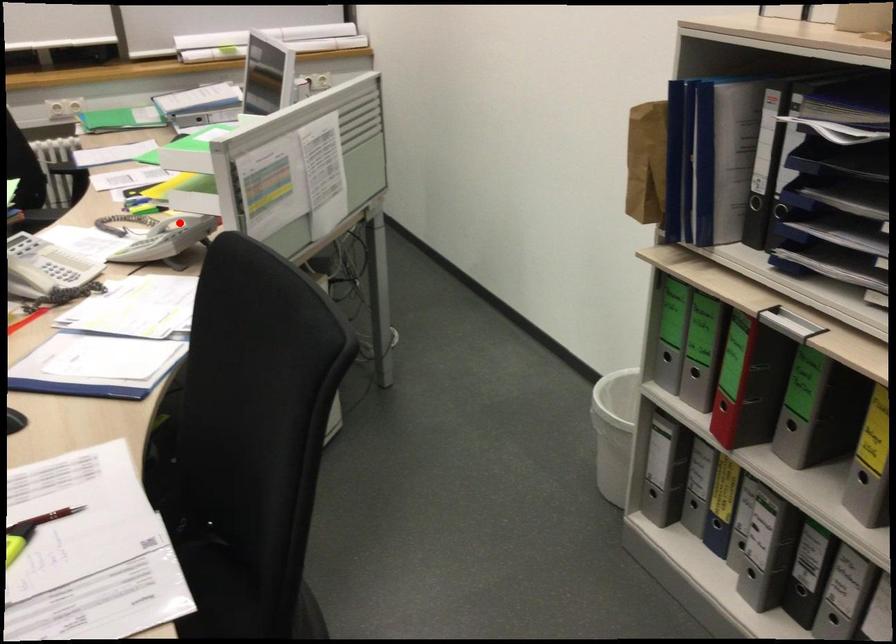
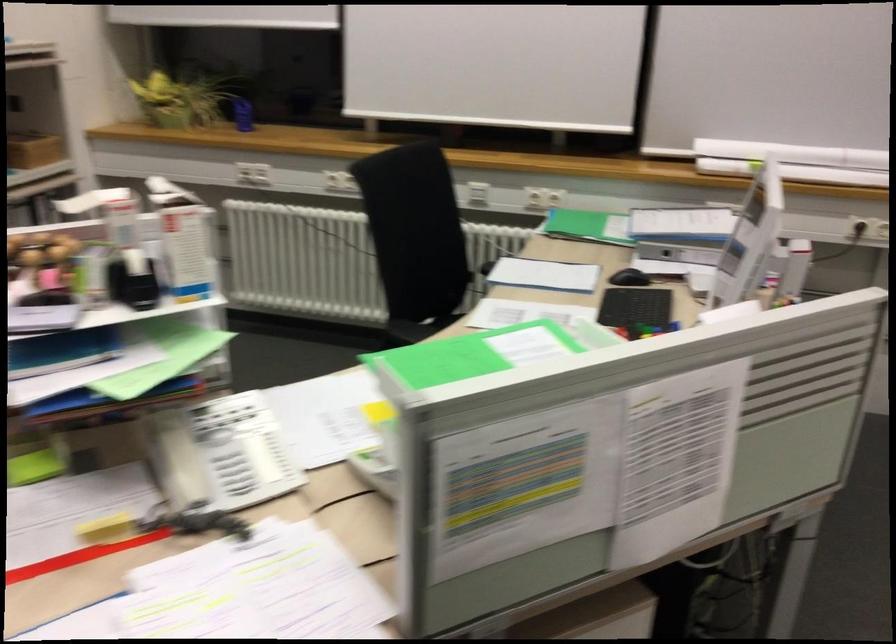
Question: I am providing you with two images of the same scene from different viewpoints. A red point is marked on the first image. At the location where the point appears in image 1, is it still visible in image 2?

Choices:
 (A) Yes
 (B) No

Answer: (B)